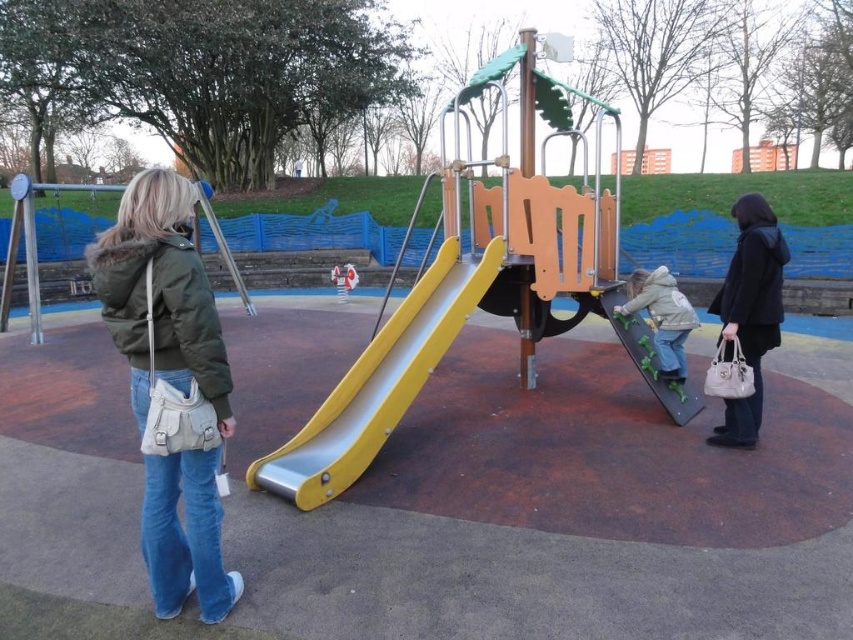
Who is higher up, matte green jacket at left or black leather jacket at right?

black leather jacket at right

Between matte green jacket at left and black leather jacket at right, which one appears on the left side from the viewer's perspective?

matte green jacket at left

What are the coordinates of `matte green jacket at left` in the screenshot? It's located at (161, 292).

Where is `matte green jacket at left`? matte green jacket at left is located at coordinates (161, 292).

Can you confirm if yellow metallic slide at center is positioned above metallic silver swing at left?

No, yellow metallic slide at center is not above metallic silver swing at left.

Consider the image. Between yellow metallic slide at center and metallic silver swing at left, which one appears on the left side from the viewer's perspective?

metallic silver swing at left

Which is behind, point (265, 483) or point (65, 224)?

The point (65, 224) is behind.

You are a GUI agent. You are given a task and a screenshot of the screen. Output one action in this format:
    pyautogui.click(x=<x>, y=<y>)
    Task: Click on the yellow metallic slide at center
    The width and height of the screenshot is (853, 640).
    Given the screenshot: What is the action you would take?
    pyautogui.click(x=379, y=381)

Does black leather jacket at right appear on the left side of metallic silver swing at left?

Incorrect, black leather jacket at right is not on the left side of metallic silver swing at left.

Is black leather jacket at right smaller than metallic silver swing at left?

Actually, black leather jacket at right might be larger than metallic silver swing at left.

Is point (740, 336) closer to viewer compared to point (74, 294)?

Yes, it is.

The width and height of the screenshot is (853, 640). I want to click on black leather jacket at right, so click(x=750, y=310).